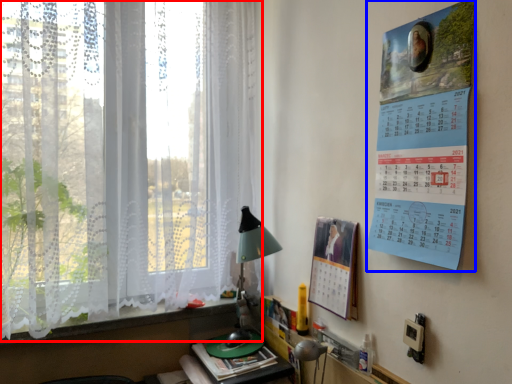
Question: Which object is further to the camera taking this photo, window (highlighted by a red box) or poster page (highlighted by a blue box)?

Choices:
 (A) window
 (B) poster page

Answer: (A)